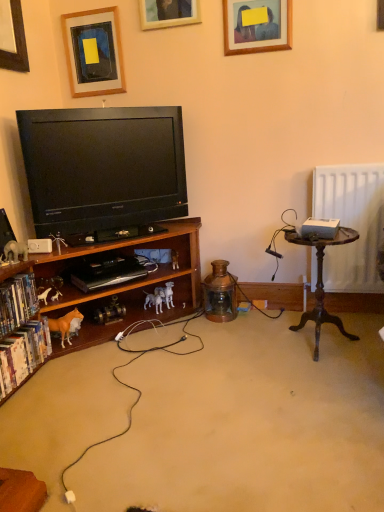
At what (x,y) coordinates should I click in order to perform the action: click on vacant area to the left of wooden vintage table at right. Please return your answer as a coordinate pair (x, y). The height and width of the screenshot is (512, 384). Looking at the image, I should click on (255, 348).